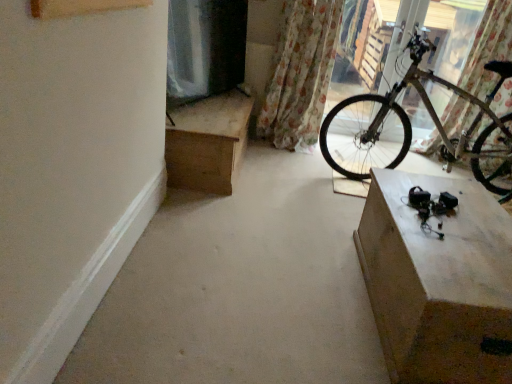
Locate an element on the screen. This screenshot has height=384, width=512. blank space situated above matte concrete cabinet at lower right (from a real-world perspective) is located at coordinates (455, 218).